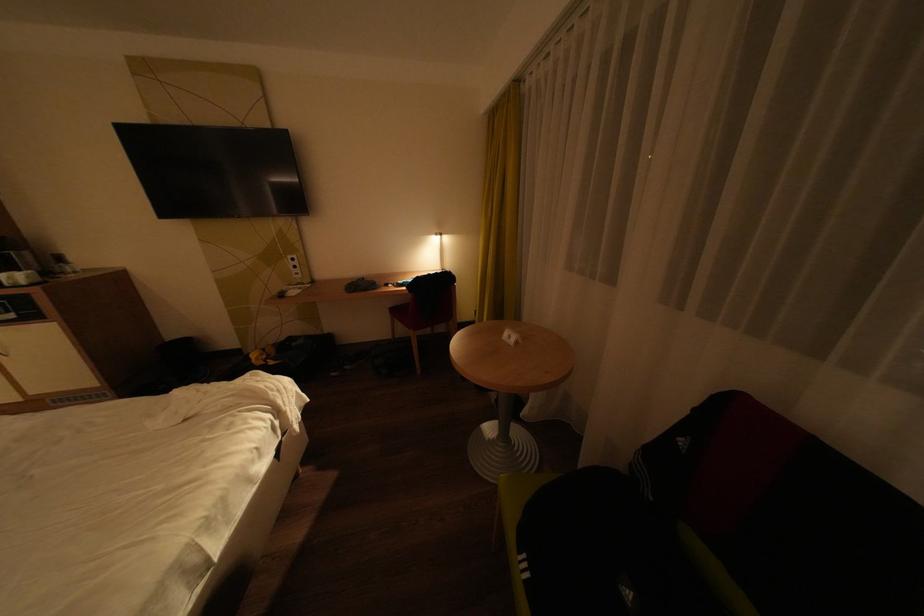
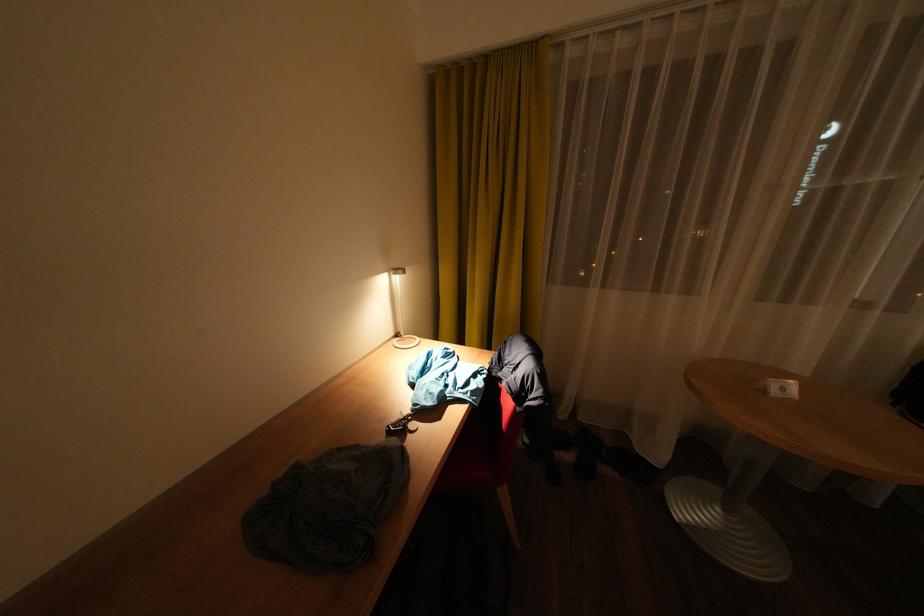
Find the pixel in the second image that matches pixel 394 285 in the first image.

(395, 436)